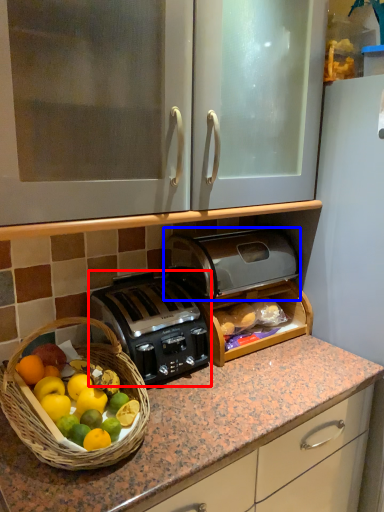
Question: Which object is further to the camera taking this photo, toaster (highlighted by a red box) or toaster (highlighted by a blue box)?

Choices:
 (A) toaster
 (B) toaster

Answer: (B)